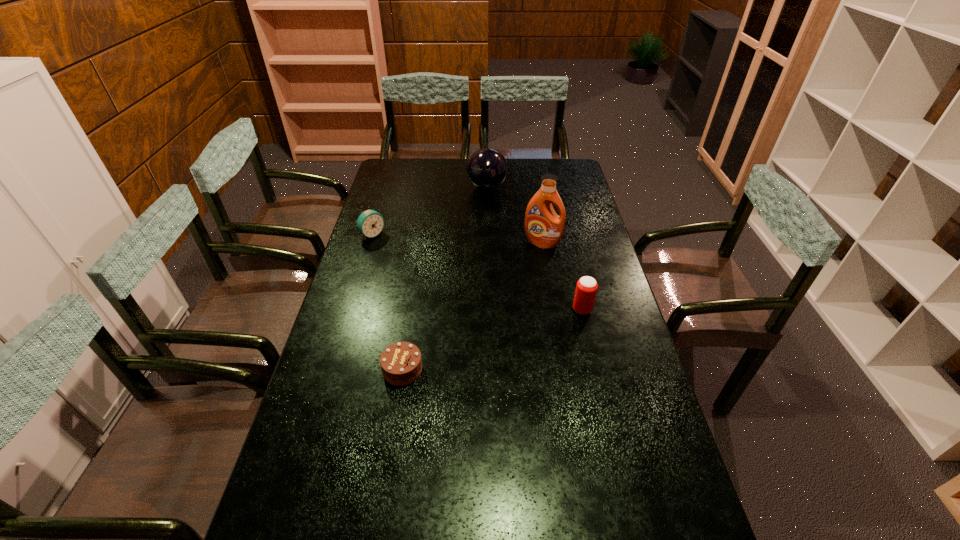
You are a GUI agent. You are given a task and a screenshot of the screen. Output one action in this format:
    pyautogui.click(x=<x>, y=<y>)
    Task: Click on the free space between the alarm clock and the tallest object
    Image resolution: width=960 pixels, height=540 pixels.
    Given the screenshot: What is the action you would take?
    pyautogui.click(x=457, y=239)

The height and width of the screenshot is (540, 960). What are the coordinates of `vacant area that lies between the beer can and the leftmost object` in the screenshot? It's located at (477, 272).

You are a GUI agent. You are given a task and a screenshot of the screen. Output one action in this format:
    pyautogui.click(x=<x>, y=<y>)
    Task: Click on the free space that is in between the beer can and the farthest object
    This screenshot has width=960, height=540.
    Given the screenshot: What is the action you would take?
    pyautogui.click(x=535, y=248)

Find the location of `vacant area between the fourth farthest object and the fourth shortest object`. vacant area between the fourth farthest object and the fourth shortest object is located at coordinates (535, 248).

Identify the location of vacant space that is in between the alarm clock and the chocolate cake. The height and width of the screenshot is (540, 960). tap(388, 302).

The image size is (960, 540). What are the coordinates of `vacant point located between the detergent and the farthest object` in the screenshot? It's located at (515, 215).

I want to click on unoccupied position between the second tallest object and the detergent, so click(x=515, y=215).

I want to click on free space between the leftmost object and the farthest object, so click(x=430, y=211).

Identify which object is located as the fourth nearest to the beer can. Please provide its 2D coordinates. Your answer should be formatted as a tuple, i.e. [(x, y)], where the tuple contains the x and y coordinates of a point satisfying the conditions above.

[(370, 223)]

You are a GUI agent. You are given a task and a screenshot of the screen. Output one action in this format:
    pyautogui.click(x=<x>, y=<y>)
    Task: Click on the second closest object to the shortest object
    The image size is (960, 540).
    Given the screenshot: What is the action you would take?
    pyautogui.click(x=370, y=223)